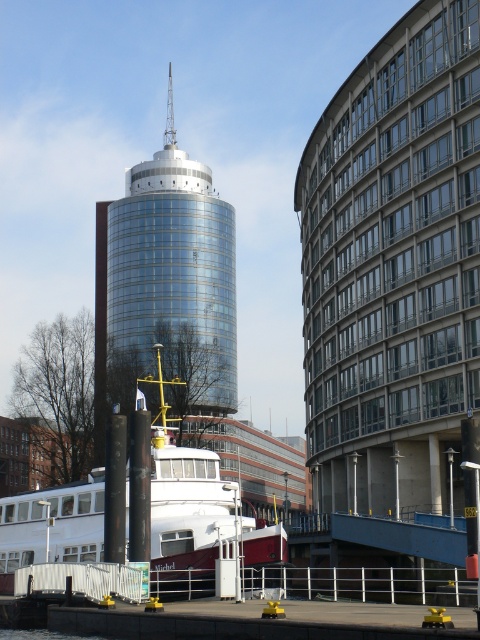
You are a photographer planning to take a photo of the waterfront scene. You want to ensure that the white glossy boat at center and the transparent water at lower left are both clearly visible in your shot. Based on their positions, which object is closer to the camera?

The white glossy boat at center is closer to the camera than the transparent water at lower left because the transparent water at lower left is behind the white glossy boat at center.

You are a photographer planning to take a photo of the shiny glass tower at center and the white glossy boat at center from a distance. If you want to ensure both objects are clearly visible in the frame, which one should you focus on first considering their sizes?

The shiny glass tower at center has a larger size compared to the white glossy boat at center, so you should focus on the shiny glass tower at center first to ensure it is in clear focus, and the boat will likely be in focus as well due to its proximity in the frame.